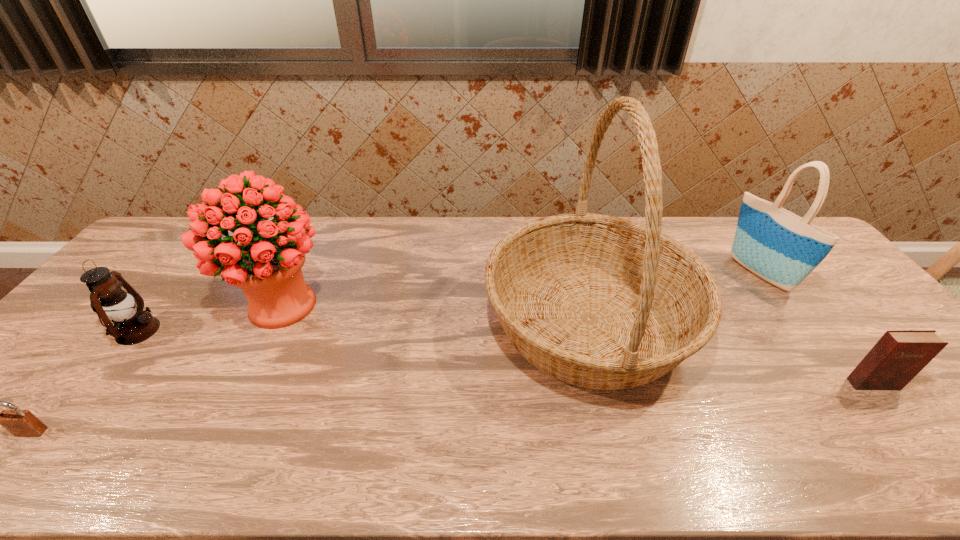
Locate an element on the screen. Image resolution: width=960 pixels, height=540 pixels. free point located on the back of the tote bag is located at coordinates (727, 230).

Locate an element on the screen. This screenshot has width=960, height=540. free space located 0.150m on the side of the third shortest object, there is a wick adjustment knob is located at coordinates [x=212, y=330].

Locate an element on the screen. This screenshot has width=960, height=540. free region located 0.050m on the front cover of the fifth tallest object is located at coordinates (893, 409).

Where is `basket at the far edge`? The width and height of the screenshot is (960, 540). basket at the far edge is located at coordinates (601, 302).

Find the location of `tote bag that is at the far edge`. tote bag that is at the far edge is located at coordinates (782, 248).

The height and width of the screenshot is (540, 960). Identify the location of object that is at the near edge. (21, 423).

Locate an element on the screen. The width and height of the screenshot is (960, 540). lantern that is at the left edge is located at coordinates (132, 325).

The image size is (960, 540). I want to click on padlock situated at the left edge, so click(x=21, y=423).

This screenshot has width=960, height=540. Identify the location of object that is at the right edge. (899, 355).

Locate an element on the screen. The width and height of the screenshot is (960, 540). object present at the near left corner is located at coordinates (21, 423).